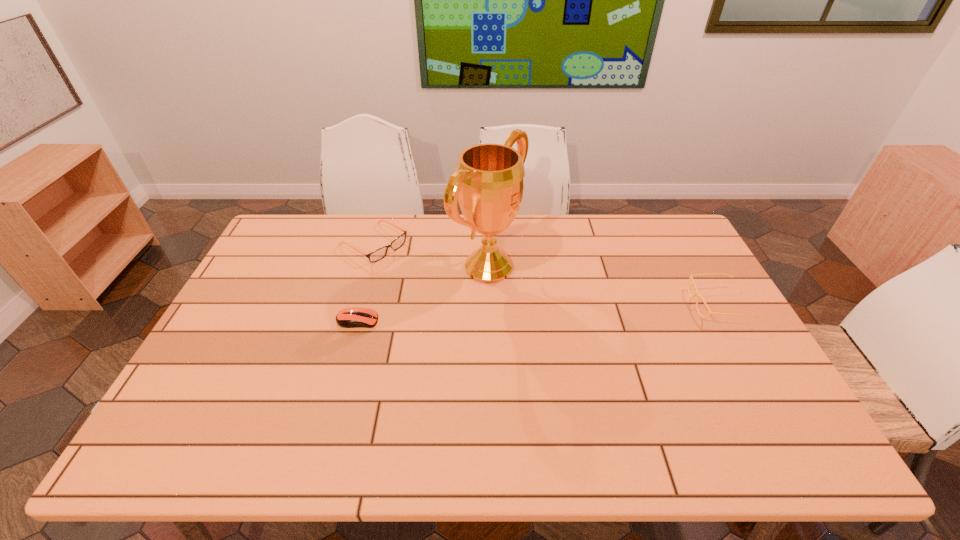
The image size is (960, 540). Identify the location of the shortest object. (350, 317).

Locate an element on the screen. This screenshot has width=960, height=540. the right spectacles is located at coordinates (696, 290).

The height and width of the screenshot is (540, 960). What are the coordinates of `the rightmost object` in the screenshot? It's located at (696, 290).

Identify the location of the left spectacles. (380, 253).

Find the location of a particular element. Image resolution: width=960 pixels, height=540 pixels. award is located at coordinates (488, 182).

Where is `the second object from right to left`? the second object from right to left is located at coordinates (488, 182).

At what (x,y) coordinates should I click in order to perform the action: click on vacant region located 0.260m on the left of the computer mouse. Please return your answer as a coordinate pair (x, y). This screenshot has width=960, height=540. Looking at the image, I should click on (247, 321).

Image resolution: width=960 pixels, height=540 pixels. Find the location of `free space located in front of the lenses of the right spectacles`. free space located in front of the lenses of the right spectacles is located at coordinates (625, 304).

Where is `vacant area situated 0.270m in front of the lenses of the right spectacles`? vacant area situated 0.270m in front of the lenses of the right spectacles is located at coordinates (602, 304).

In order to click on vacant area situated in front of the lenses of the right spectacles in this screenshot , I will do `click(565, 304)`.